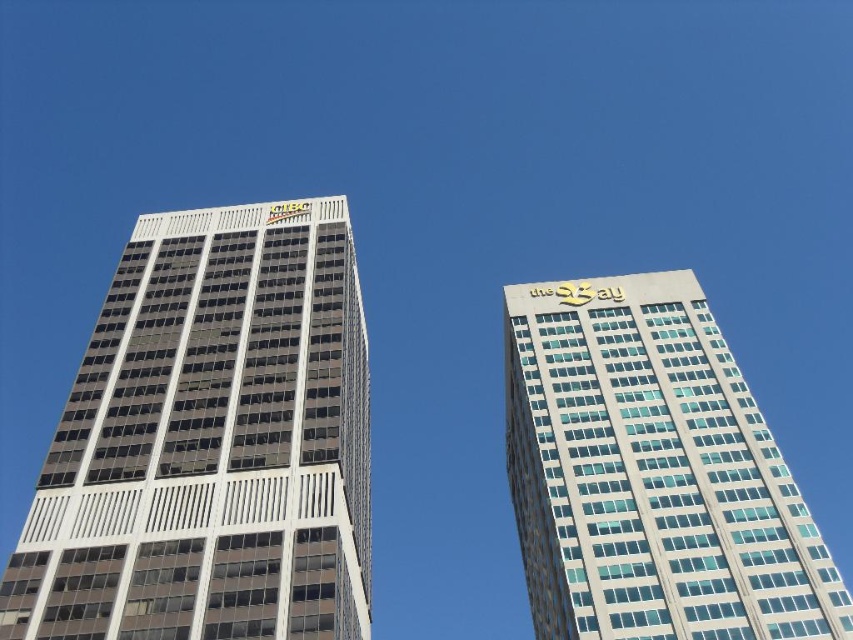
Question: Does matte glass building at left appear on the right side of white glass building at right?

Choices:
 (A) no
 (B) yes

Answer: (A)

Question: Which point is closer to the camera?

Choices:
 (A) (543, 580)
 (B) (289, 406)

Answer: (B)

Question: Which point is closer to the camera?

Choices:
 (A) matte glass building at left
 (B) white glass building at right

Answer: (A)

Question: Does matte glass building at left appear on the right side of white glass building at right?

Choices:
 (A) yes
 (B) no

Answer: (B)

Question: Does matte glass building at left appear on the right side of white glass building at right?

Choices:
 (A) yes
 (B) no

Answer: (B)